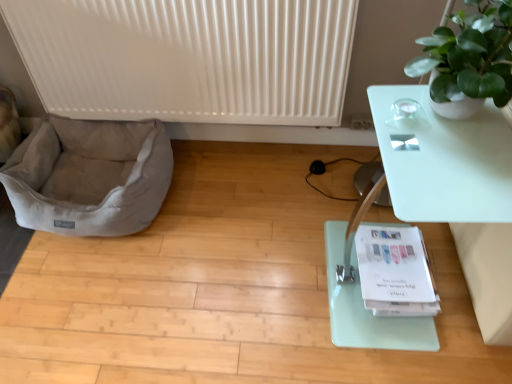
You are a GUI agent. You are given a task and a screenshot of the screen. Output one action in this format:
    pyautogui.click(x=<x>, y=<y>)
    Task: Click on the free location to the right of light gray fabric dog bed at lower left
    This screenshot has height=384, width=512.
    Given the screenshot: What is the action you would take?
    pyautogui.click(x=227, y=211)